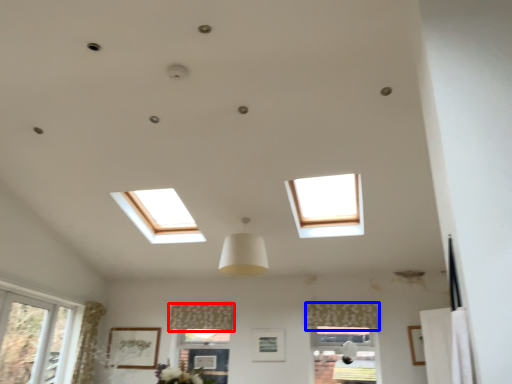
Question: Which point is closer to the camera, curtain (highlighted by a red box) or curtain (highlighted by a blue box)?

Choices:
 (A) curtain
 (B) curtain

Answer: (B)